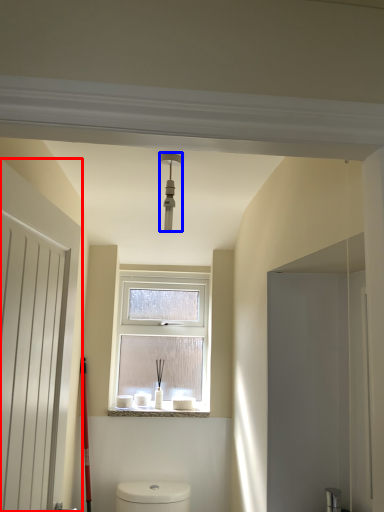
Question: Which of the following is the farthest to the observer, door (highlighted by a red box) or light fixture (highlighted by a blue box)?

Choices:
 (A) door
 (B) light fixture

Answer: (B)